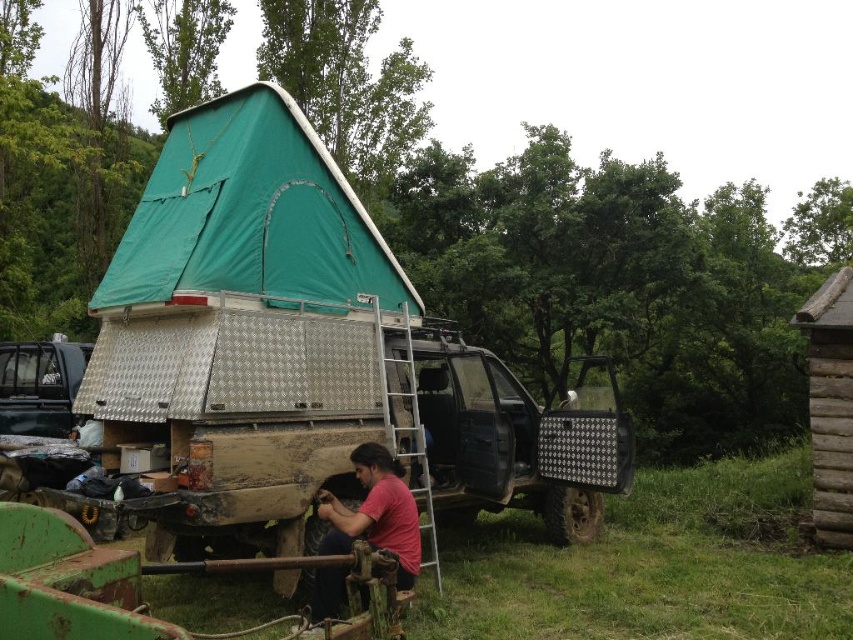
Question: Is the position of brown wooden hut at right less distant than that of brushed metal truck at left?

Choices:
 (A) yes
 (B) no

Answer: (A)

Question: Which of the following is the farthest from the observer?

Choices:
 (A) (370, 513)
 (B) (15, 355)

Answer: (B)

Question: Is green fabric tent at upper left closer to the viewer compared to brushed metal truck at left?

Choices:
 (A) no
 (B) yes

Answer: (B)

Question: Which of the following is the closest to the observer?

Choices:
 (A) (393, 502)
 (B) (338, 237)
 (C) (816, 380)

Answer: (A)

Question: Which of these objects is positioned closest to the brown wooden hut at right?

Choices:
 (A) pink matte shirt at center
 (B) green fabric tent at upper left

Answer: (A)

Question: Does green fabric tent at upper left appear over brown wooden hut at right?

Choices:
 (A) yes
 (B) no

Answer: (A)